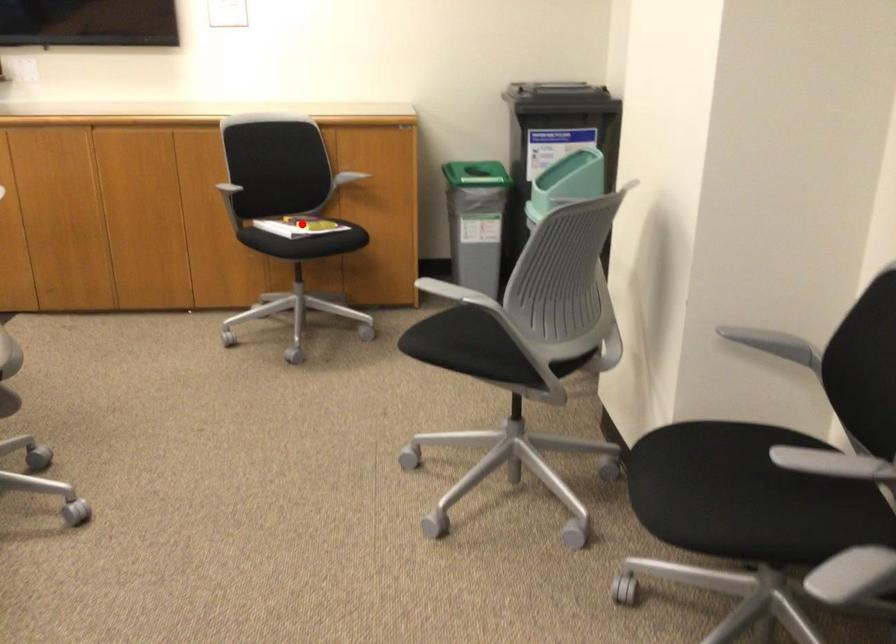
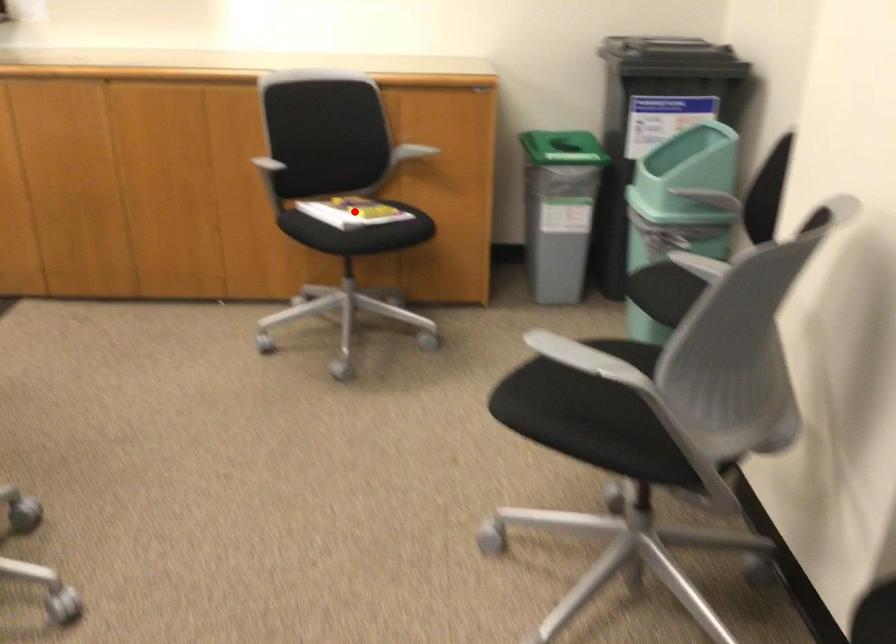
I am providing you with two images of the same scene from different viewpoints. A red point is marked on the first image and another point is marked on the second image. Is the marked point in image1 the same physical position as the marked point in image2?

Yes